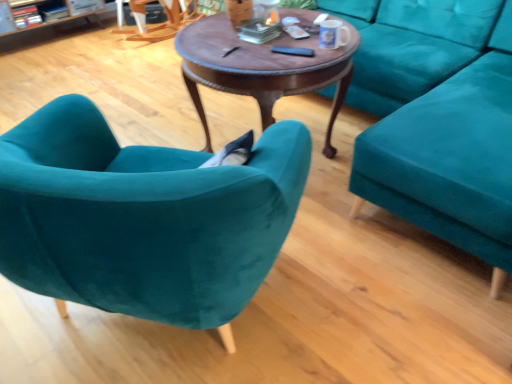
Find the location of a particular element. vacant space that is to the left of black matte remote control at center, which is counted as the 2th remote control, starting from the back is located at coordinates (249, 60).